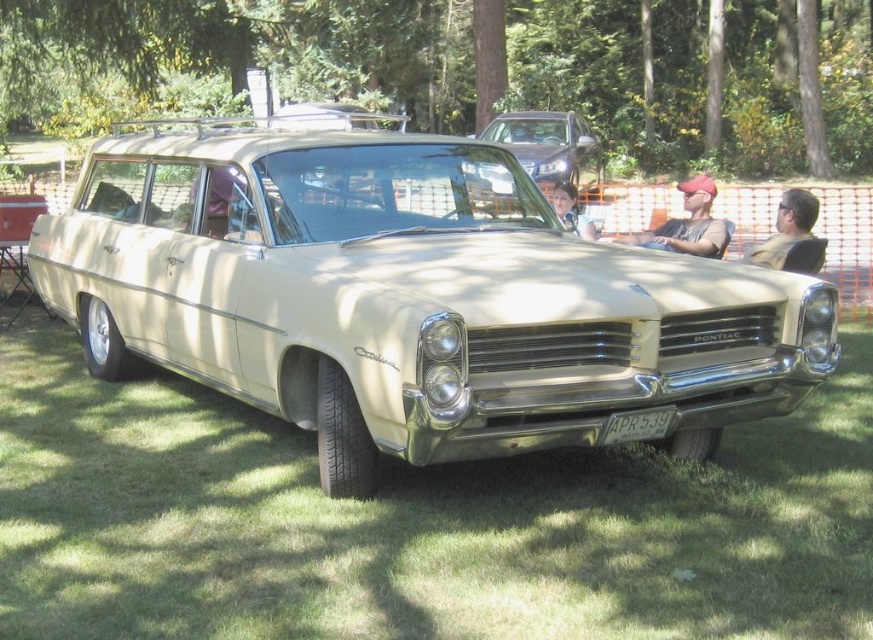
You are at a car show and want to take a photo of the beige metallic station wagon at center. To avoid sunlight glare, you decide to position yourself so that the green leafy tree at upper center casts a shadow over the car. Is the current position of the tree suitable for this purpose?

The beige metallic station wagon at center is located below the green leafy tree at upper center, so the tree is positioned directly overhead. This placement should provide sufficient shade to reduce sunlight glare on the car for your photo.

You are standing at the point marked as point (416, 524) in the image. What is the surface you are currently standing on?

The surface at point (416, 524) is green grass at center.